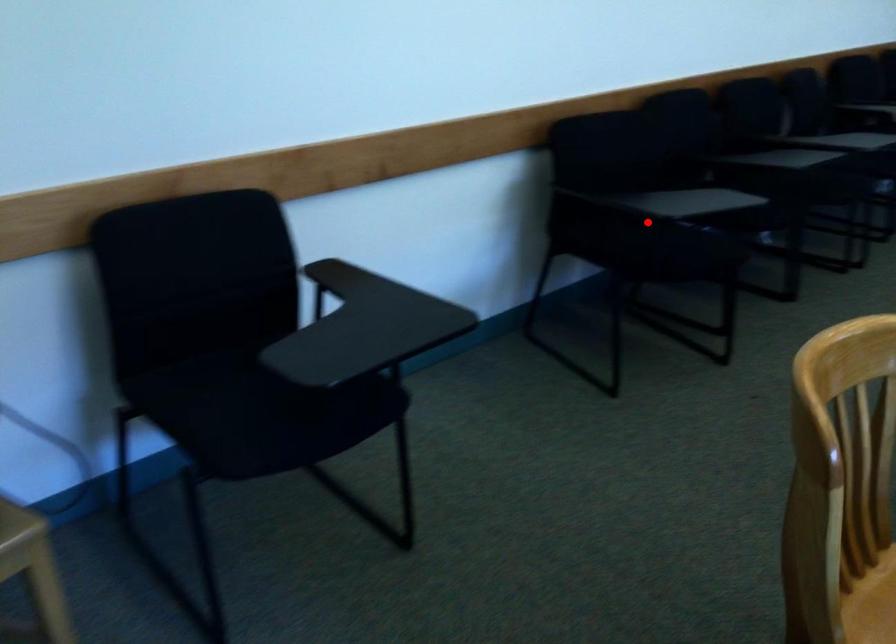
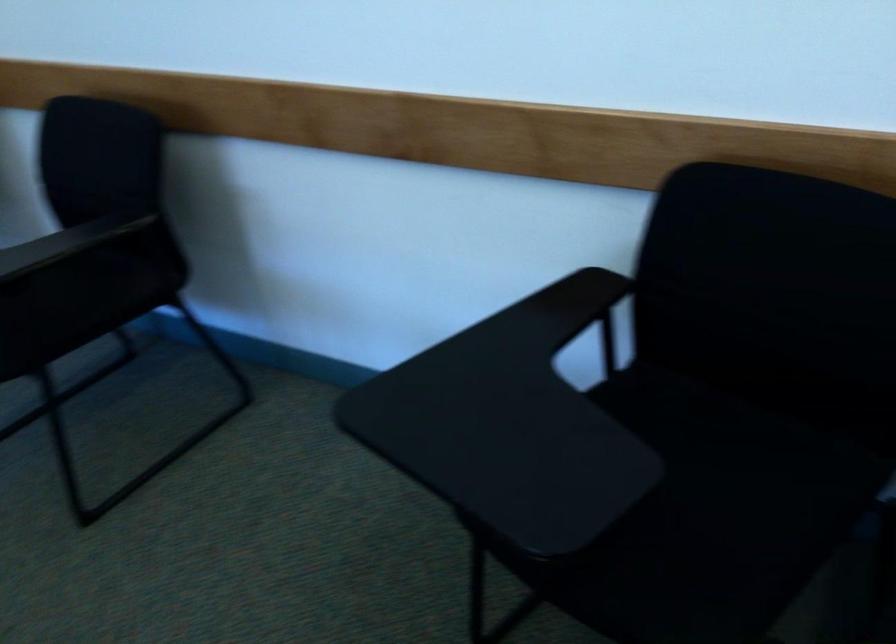
Find the pixel in the second image that matches the highlighted location in the first image.

(743, 457)